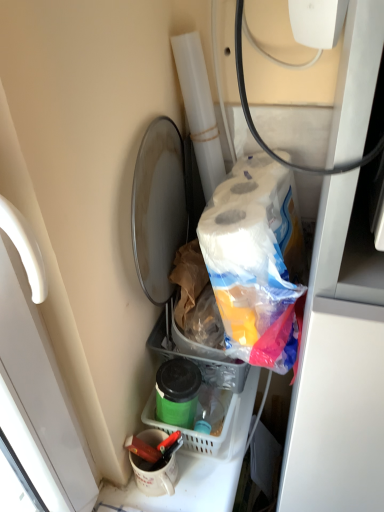
I want to click on white glossy coffee cup at lower center, so click(155, 477).

This screenshot has height=512, width=384. What do you see at coordinates (155, 477) in the screenshot?
I see `white glossy coffee cup at lower center` at bounding box center [155, 477].

Identify the location of white glossy coffee cup at lower center. (155, 477).